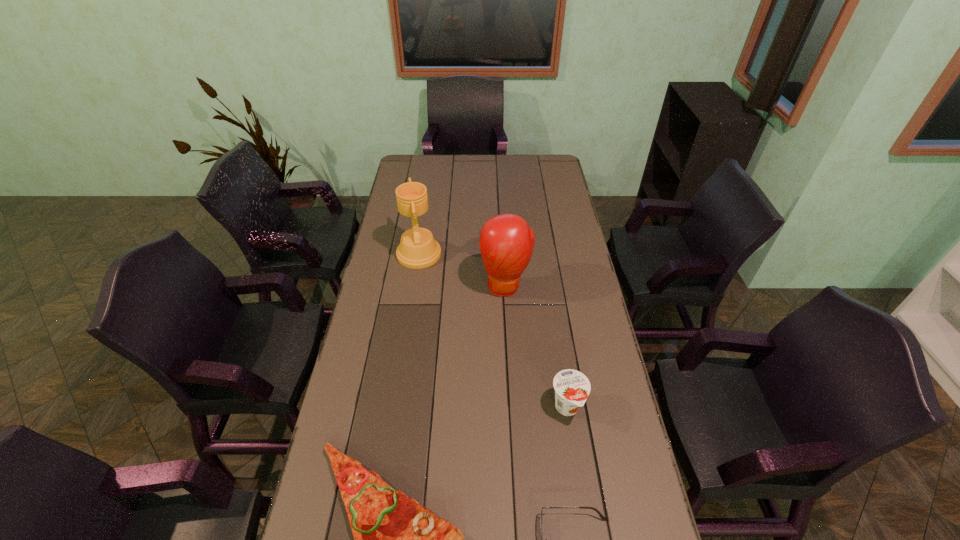
Identify the location of free location at the left edge. (351, 379).

At what (x,y) coordinates should I click in order to perform the action: click on vacant space at the right edge. Please return your answer as a coordinate pair (x, y). The image size is (960, 540). Looking at the image, I should click on (552, 258).

In the image, there is a desktop. Where is `free space at the far left corner`? The width and height of the screenshot is (960, 540). free space at the far left corner is located at coordinates (413, 157).

You are a GUI agent. You are given a task and a screenshot of the screen. Output one action in this format:
    pyautogui.click(x=<x>, y=<y>)
    Task: Click on the vacant region at the far right corner
    
    Given the screenshot: What is the action you would take?
    pyautogui.click(x=536, y=171)

The width and height of the screenshot is (960, 540). Find the location of `empty space between the third tallest object and the award`. empty space between the third tallest object and the award is located at coordinates point(493,331).

The image size is (960, 540). I want to click on free space that is in between the boxing glove and the yogurt, so coord(537,347).

Locate which object ranks second in proximity to the third nearest object. Please provide its 2D coordinates. Your answer should be formatted as a tuple, i.e. [(x, y)], where the tuple contains the x and y coordinates of a point satisfying the conditions above.

[(395, 539)]

Where is `object identified as the second closest to the boxing glove`? The height and width of the screenshot is (540, 960). object identified as the second closest to the boxing glove is located at coordinates (572, 387).

The width and height of the screenshot is (960, 540). What are the coordinates of `free space that satisfies the following two spatial constraints: 1. on the striking surface of the boxing glove; 2. on the right side of the yogurt` in the screenshot? It's located at (513, 408).

You are a GUI agent. You are given a task and a screenshot of the screen. Output one action in this format:
    pyautogui.click(x=<x>, y=<y>)
    Task: Click on the free location that satisfies the following two spatial constraints: 1. on the striking surface of the yogurt; 2. on the right side of the boxing glove
    Image resolution: width=960 pixels, height=540 pixels.
    Given the screenshot: What is the action you would take?
    pyautogui.click(x=513, y=408)